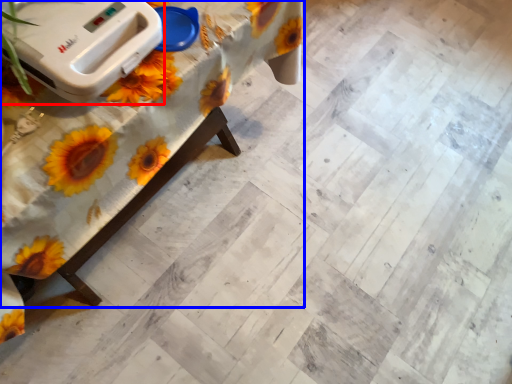
Question: Which object is closer to the camera taking this photo, appliance (highlighted by a red box) or table (highlighted by a blue box)?

Choices:
 (A) appliance
 (B) table

Answer: (B)